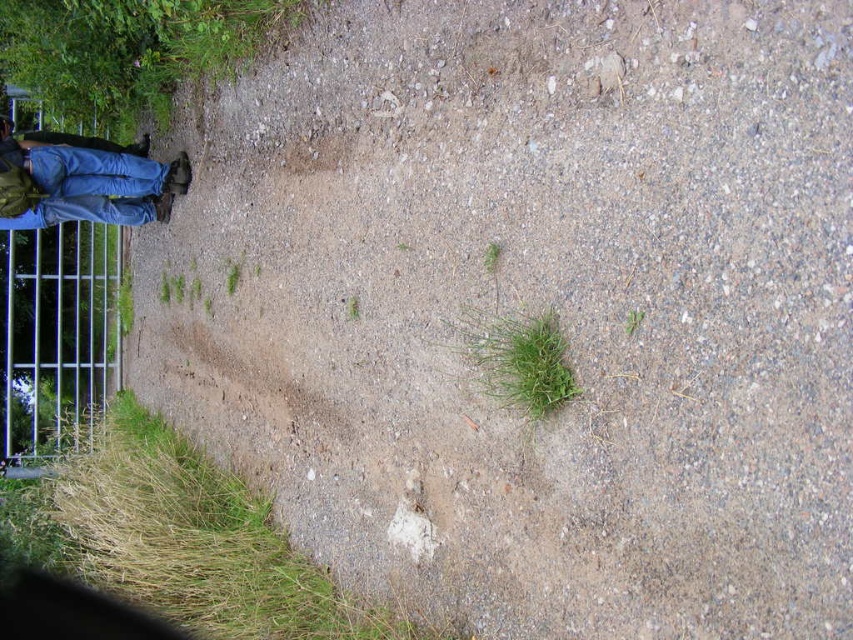
Question: Can you confirm if green grass at lower left is positioned to the right of blue jeans at left?

Choices:
 (A) no
 (B) yes

Answer: (B)

Question: Which point appears farthest from the camera in this image?

Choices:
 (A) (25, 378)
 (B) (170, 452)
 (C) (137, 202)

Answer: (A)

Question: Which object is closer to the camera taking this photo?

Choices:
 (A) green leafy grass at center
 (B) blue jeans at left

Answer: (A)

Question: Does green grass at lower left appear under metallic silver fence at left?

Choices:
 (A) no
 (B) yes

Answer: (B)

Question: Does metallic silver fence at left appear on the left side of green leafy grass at center?

Choices:
 (A) no
 (B) yes

Answer: (B)

Question: Among these objects, which one is nearest to the camera?

Choices:
 (A) green grass at lower left
 (B) metallic silver fence at left
 (C) green leafy grass at center

Answer: (C)